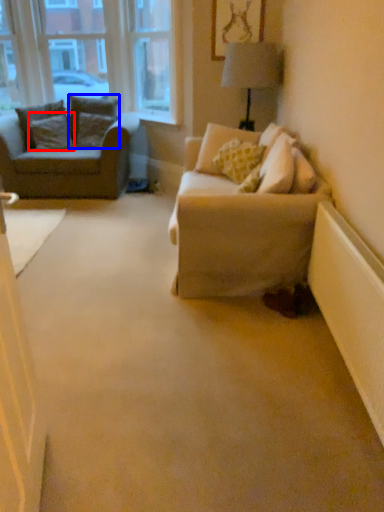
Question: Which object appears farthest to the camera in this image, pillow (highlighted by a red box) or pillow (highlighted by a blue box)?

Choices:
 (A) pillow
 (B) pillow

Answer: (B)